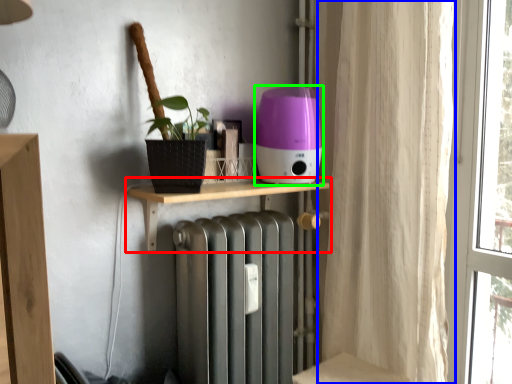
Question: Which is farther away from shelf (highlighted by a red box)? curtain (highlighted by a blue box) or appliance (highlighted by a green box)?

Choices:
 (A) curtain
 (B) appliance

Answer: (A)